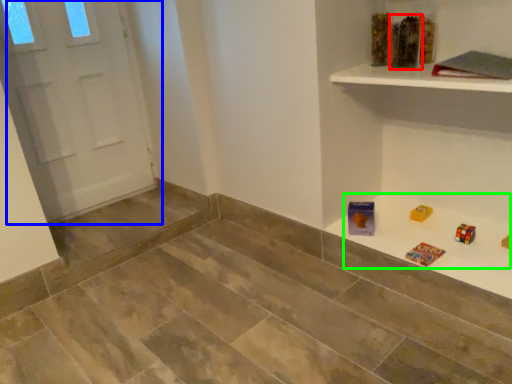
Question: Which object is the closest to the toy (highlighted by a red box)? Choose among these: door (highlighted by a blue box) or game (highlighted by a green box).

Choices:
 (A) door
 (B) game

Answer: (B)